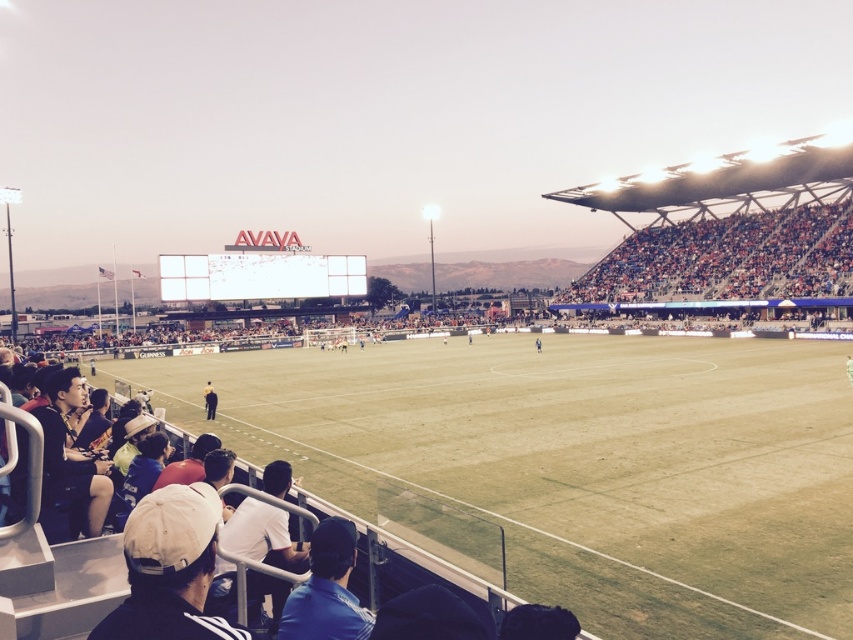
Question: Estimate the real-world distances between objects in this image. Which object is farther from the green grass football field at center?

Choices:
 (A) blue jersey at center
 (B) white fabric cap at lower left
 (C) multicolored fabric seats at right
 (D) dark blue shirt at lower left

Answer: (C)

Question: Which is farther from the white fabric cap at lower left?

Choices:
 (A) dark blue shirt at lower left
 (B) blue fabric jacket at lower center

Answer: (A)

Question: Which point is closer to the camera taking this photo?

Choices:
 (A) (537, 339)
 (B) (610, 278)
 (C) (207, 419)

Answer: (C)

Question: Can you confirm if green grass football field at center is wider than blue fabric jacket at lower center?

Choices:
 (A) yes
 (B) no

Answer: (A)

Question: Is green grass football field at center further to the viewer compared to blue jersey at center?

Choices:
 (A) yes
 (B) no

Answer: (B)

Question: Is green grass football field at center below multicolored fabric seats at right?

Choices:
 (A) no
 (B) yes

Answer: (B)